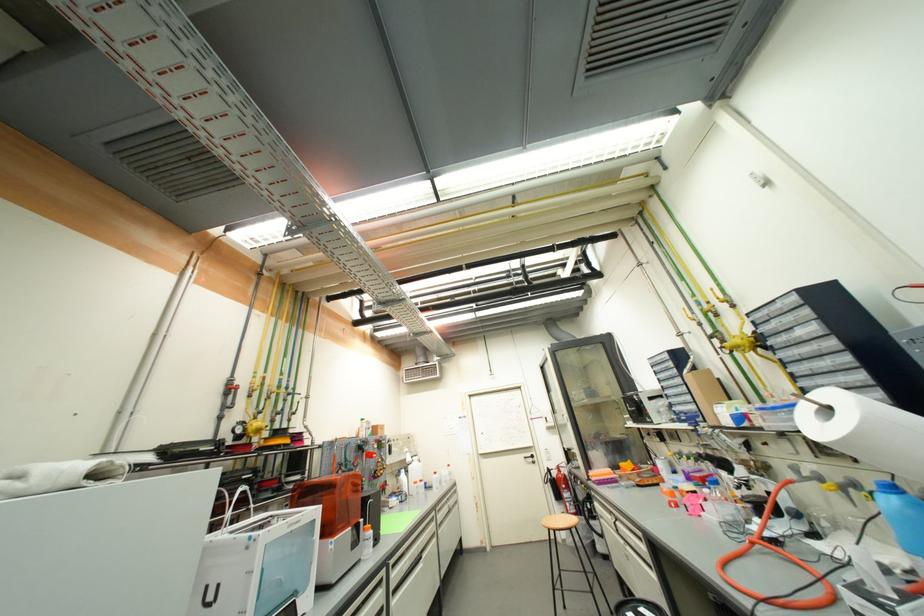
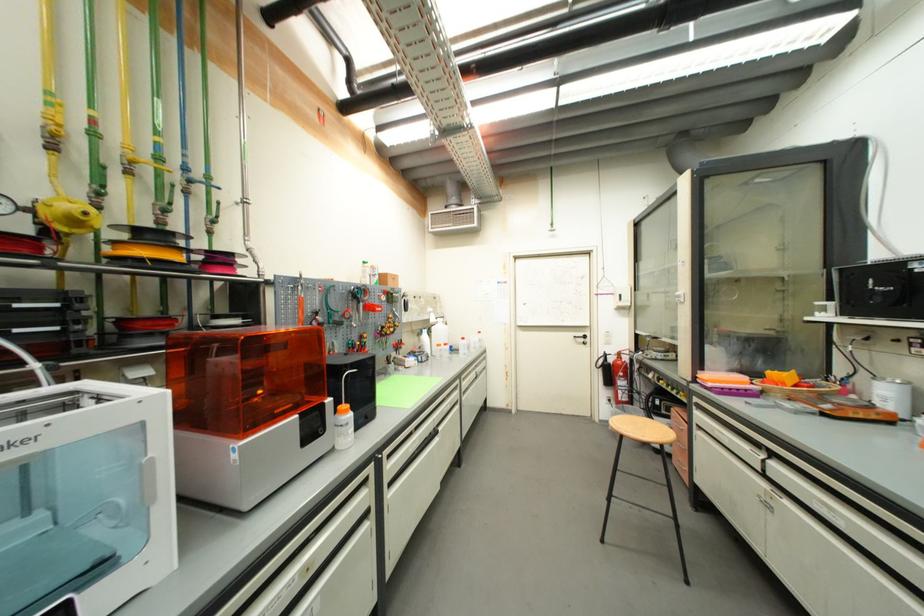
Locate, in the second image, the point that corresponds to [622,474] in the first image.

(761, 383)